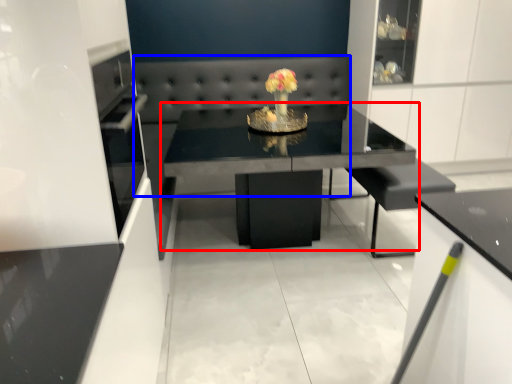
Question: Which point is further to the camera, table (highlighted by a red box) or couch (highlighted by a blue box)?

Choices:
 (A) table
 (B) couch

Answer: (B)